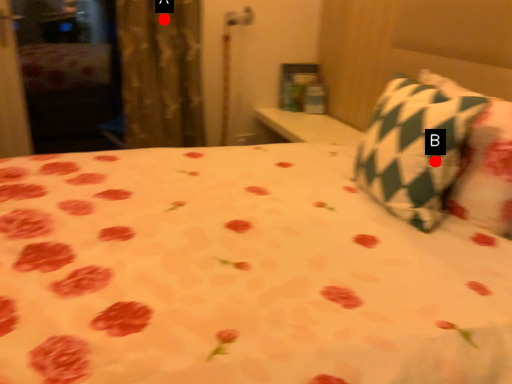
Question: Two points are circled on the image, labeled by A and B beside each circle. Among these points, which one is nearest to the camera?

Choices:
 (A) A is closer
 (B) B is closer

Answer: (B)